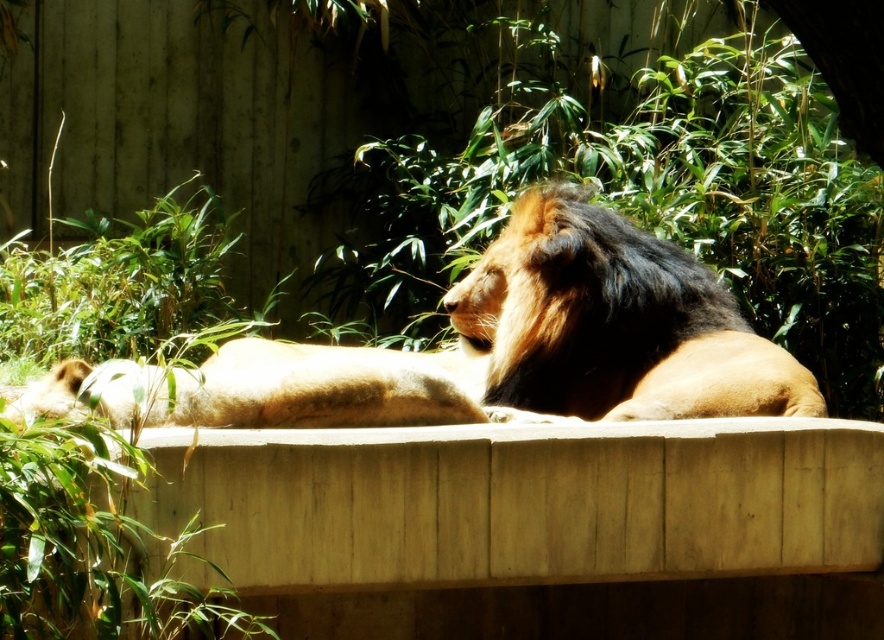
You are a wildlife photographer trying to capture a clear photo of the lion. You notice two lions in the image, the brown fur lion at center and the golden fur lion at center. Which lion is blocking the view of the other?

The brown fur lion at center is positioned over golden fur lion at center, so the brown fur lion at center is blocking the view of the golden fur lion at center.

You are a photographer taking a photo of the lion. You notice two points in the image at coordinates point (x=558, y=244) and point (x=551, y=204). Which point is closer to the camera?

Answer: Point (x=551, y=204) is closer to the camera because it is less further than point (x=558, y=244).